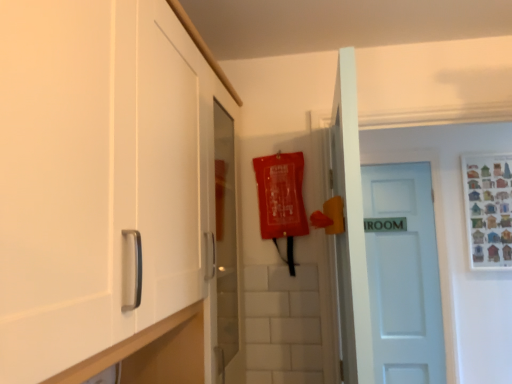
Question: From the image's perspective, is white matte door at center over white matte cabinet at left?

Choices:
 (A) yes
 (B) no

Answer: (B)

Question: From a real-world perspective, is white matte door at center physically above white matte cabinet at left?

Choices:
 (A) no
 (B) yes

Answer: (A)

Question: Could white matte cabinet at left be considered to be inside white matte door at center?

Choices:
 (A) no
 (B) yes

Answer: (A)

Question: Does white matte door at center turn towards white matte cabinet at left?

Choices:
 (A) no
 (B) yes

Answer: (A)

Question: Is white matte door at center facing away from white matte cabinet at left?

Choices:
 (A) no
 (B) yes

Answer: (A)

Question: From the image's perspective, does white matte door at center appear lower than white matte cabinet at left?

Choices:
 (A) no
 (B) yes

Answer: (B)

Question: Does white matte cabinet at left have a lesser width compared to white matte door at center?

Choices:
 (A) no
 (B) yes

Answer: (A)

Question: From the image's perspective, is white matte cabinet at left under white matte door at center?

Choices:
 (A) no
 (B) yes

Answer: (A)

Question: From the image's perspective, is white matte cabinet at left on white matte door at center?

Choices:
 (A) no
 (B) yes

Answer: (B)

Question: Is the surface of white matte cabinet at left in direct contact with white matte door at center?

Choices:
 (A) yes
 (B) no

Answer: (B)

Question: Is the depth of white matte cabinet at left less than that of white matte door at center?

Choices:
 (A) yes
 (B) no

Answer: (A)

Question: Does white matte cabinet at left lie behind white matte door at center?

Choices:
 (A) yes
 (B) no

Answer: (B)

Question: Considering their positions, is white matte door at center located in front of or behind white matte cabinet at left?

Choices:
 (A) behind
 (B) front

Answer: (A)